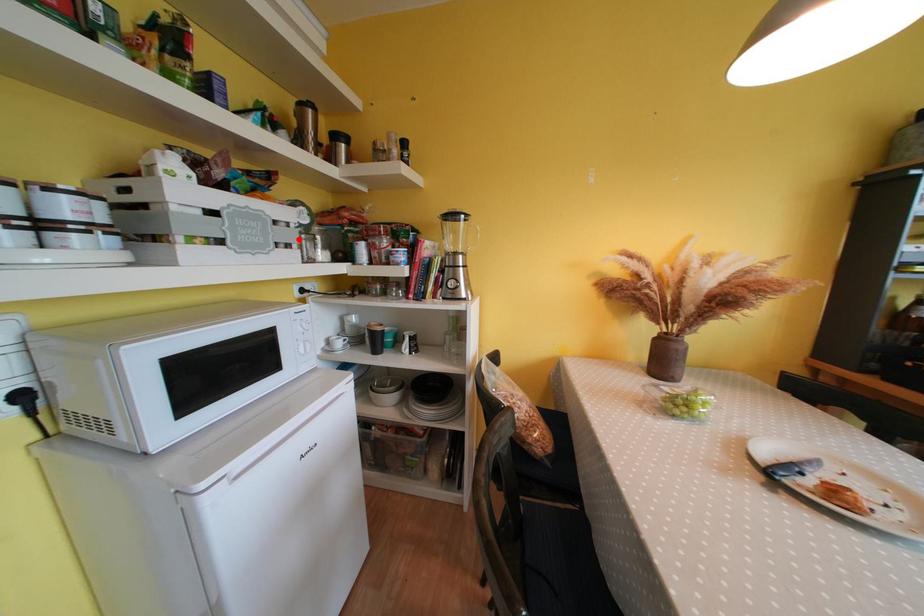
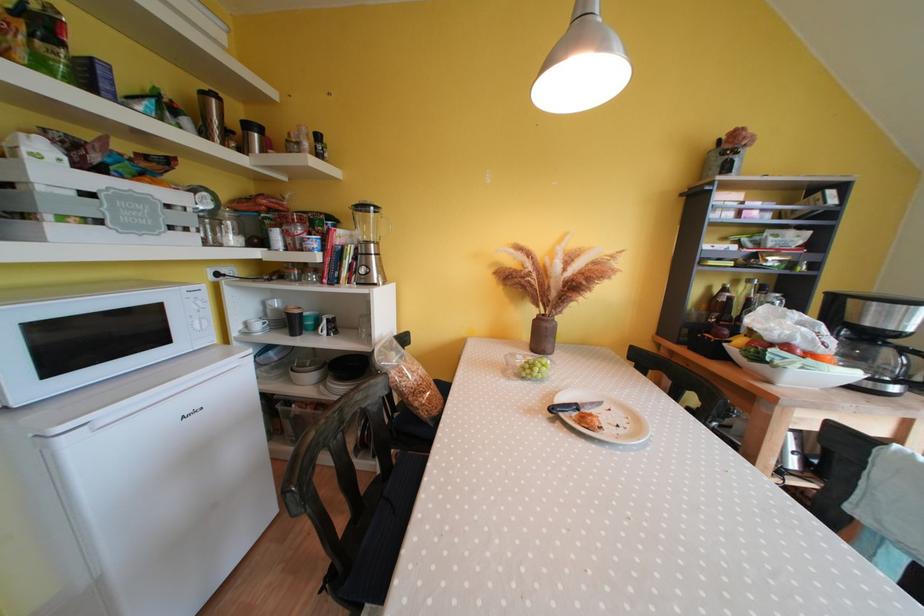
Where in the second image is the point corresponding to the highlighted location from the first image?

(196, 224)